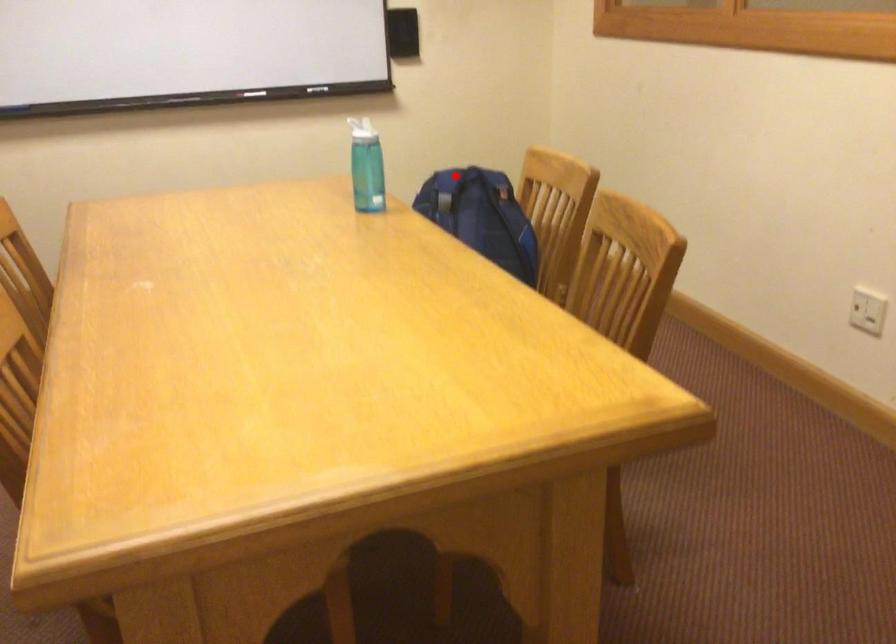
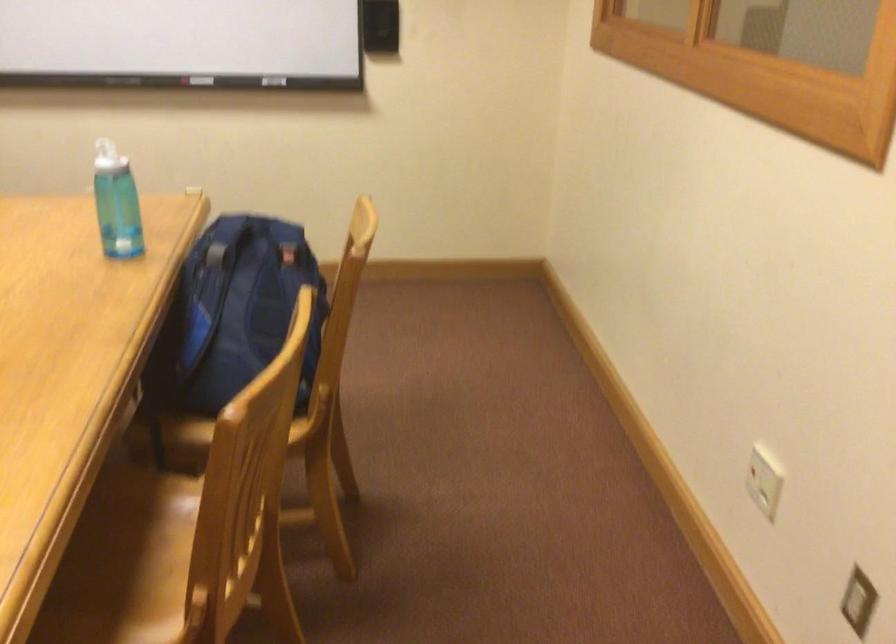
Locate, in the second image, the point that corresponds to the highlighted location in the first image.

(254, 225)